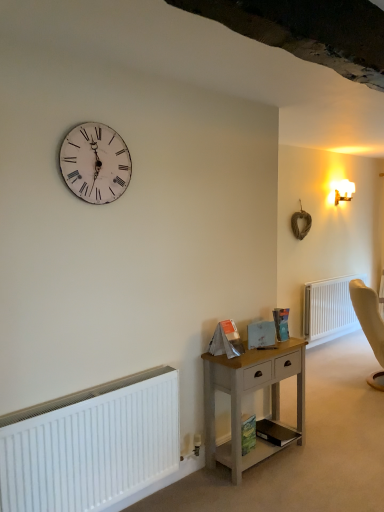
Describe the element at coordinates (248, 393) in the screenshot. This screenshot has width=384, height=512. I see `light wood nightstand at lower center` at that location.

Measure the distance between point (318, 339) and camera.

The distance of point (318, 339) from camera is 17.86 feet.

At what (x,y) coordinates should I click in order to perform the action: click on green matte book at lower center, which is the second book from top to bottom. Please return your answer as a coordinate pair (x, y). Image resolution: width=384 pixels, height=512 pixels. Looking at the image, I should click on (248, 433).

The image size is (384, 512). I want to click on white distressed wood clock at upper left, so click(95, 163).

The width and height of the screenshot is (384, 512). What do you see at coordinates (276, 432) in the screenshot? I see `black matte book at lower center, positioned as the first book in bottom-to-top order` at bounding box center [276, 432].

Measure the distance between point (76, 424) and camera.

Point (76, 424) and camera are 2.02 meters apart from each other.

Where is `light wood nightstand at lower center`? The image size is (384, 512). light wood nightstand at lower center is located at coordinates (248, 393).

Which is more to the right, light wood nightstand at lower center or white matte radiator at lower left, which ranks as the second radiator in right-to-left order?

From the viewer's perspective, light wood nightstand at lower center appears more on the right side.

Which object is closer to the camera, light wood nightstand at lower center or white matte radiator at lower left, positioned as the second radiator in back-to-front order?

white matte radiator at lower left, positioned as the second radiator in back-to-front order.

Who is smaller, light wood nightstand at lower center or white matte radiator at lower left, arranged as the first radiator when viewed from the front?

white matte radiator at lower left, arranged as the first radiator when viewed from the front, is smaller.

Considering the positions of point (234, 425) and point (51, 418), is point (234, 425) closer or farther from the camera than point (51, 418)?

Point (234, 425).

Considering the points (153, 378) and (273, 440), which point is behind, point (153, 378) or point (273, 440)?

Point (273, 440)

Based on the photo, from a real-world perspective, which object stands above the other?

white matte radiator at lower left, the first radiator from the left.

Is black matte book at lower center, marked as the 3th book in a top-to-bottom arrangement, located within white matte radiator at lower left, arranged as the first radiator when viewed from the front?

No, black matte book at lower center, marked as the 3th book in a top-to-bottom arrangement, is not a part of white matte radiator at lower left, arranged as the first radiator when viewed from the front.

Is white matte radiator at lower left, the first radiator from the left, looking in the opposite direction of black matte book at lower center, positioned as the first book in bottom-to-top order?

No, white matte radiator at lower left, the first radiator from the left, is not facing the opposite direction of black matte book at lower center, positioned as the first book in bottom-to-top order.

Which object is closer to the camera taking this photo, white matte radiator at lower left, which ranks as the second radiator in right-to-left order, or green matte book at lower center, marked as the second book in a bottom-to-top arrangement?

white matte radiator at lower left, which ranks as the second radiator in right-to-left order, is more forward.

Is white matte radiator at lower left, which ranks as the second radiator in right-to-left order, taller than green matte book at lower center, marked as the second book in a bottom-to-top arrangement?

Indeed, white matte radiator at lower left, which ranks as the second radiator in right-to-left order, has a greater height compared to green matte book at lower center, marked as the second book in a bottom-to-top arrangement.

From a real-world perspective, which is physically below, white matte radiator at lower left, positioned as the second radiator in back-to-front order, or green matte book at lower center, marked as the second book in a bottom-to-top arrangement?

green matte book at lower center, marked as the second book in a bottom-to-top arrangement.

Can you confirm if green matte book at lower center, which is the second book from top to bottom, is wider than white matte radiator at lower left, arranged as the first radiator when viewed from the front?

Incorrect, the width of green matte book at lower center, which is the second book from top to bottom, does not surpass that of white matte radiator at lower left, arranged as the first radiator when viewed from the front.

Based on the photo, in terms of size, does green matte book at lower center, which is the second book from top to bottom, appear bigger or smaller than white matte radiator at lower left, the first radiator from the left?

Considering their sizes, green matte book at lower center, which is the second book from top to bottom, takes up less space than white matte radiator at lower left, the first radiator from the left.

From a real-world perspective, is green matte book at lower center, which is the second book from top to bottom, positioned under white matte radiator at lower left, positioned as the second radiator in back-to-front order, based on gravity?

Yes.

Is light wood nightstand at lower center behind white distressed wood clock at upper left?

Yes, light wood nightstand at lower center is behind white distressed wood clock at upper left.

Is light wood nightstand at lower center bigger than white distressed wood clock at upper left?

Yes, light wood nightstand at lower center is bigger than white distressed wood clock at upper left.

From a real-world perspective, does light wood nightstand at lower center stand above white distressed wood clock at upper left?

No, from a real-world perspective, light wood nightstand at lower center is not over white distressed wood clock at upper left

Is white distressed wood clock at upper left at the back of light wood nightstand at lower center?

light wood nightstand at lower center is not turned away from white distressed wood clock at upper left.

From the image's perspective, is white plastic radiator at lower right, placed as the second radiator when sorted from front to back, below white distressed wood clock at upper left?

Yes, from the image's perspective, white plastic radiator at lower right, placed as the second radiator when sorted from front to back, is beneath white distressed wood clock at upper left.

You are a GUI agent. You are given a task and a screenshot of the screen. Output one action in this format:
    pyautogui.click(x=<x>, y=<y>)
    Task: Click on the wall clock above the white plastic radiator at lower right, placed as the second radiator when sorted from front to back (from the image's perspective)
    
    Given the screenshot: What is the action you would take?
    pyautogui.click(x=95, y=163)

Based on the photo, considering the sizes of white plastic radiator at lower right, arranged as the first radiator when viewed from the right, and white distressed wood clock at upper left in the image, is white plastic radiator at lower right, arranged as the first radiator when viewed from the right, bigger or smaller than white distressed wood clock at upper left?

white plastic radiator at lower right, arranged as the first radiator when viewed from the right, is bigger than white distressed wood clock at upper left.

Does white plastic radiator at lower right, which appears as the first radiator when viewed from the back, appear on the left side of white distressed wood clock at upper left?

No, white plastic radiator at lower right, which appears as the first radiator when viewed from the back, is not to the left of white distressed wood clock at upper left.

How different are the orientations of white frosted glass sconce at upper right and white matte radiator at lower left, positioned as the second radiator in back-to-front order, in degrees?

They differ by 0.336 degrees in their facing directions.

Locate an element on the screen. This screenshot has width=384, height=512. light fixture on the right of white matte radiator at lower left, the first radiator from the left is located at coordinates (343, 190).

From the image's perspective, is white frosted glass sconce at upper right under white matte radiator at lower left, arranged as the first radiator when viewed from the front?

No.

Considering the sizes of white frosted glass sconce at upper right and white matte radiator at lower left, arranged as the first radiator when viewed from the front, in the image, is white frosted glass sconce at upper right bigger or smaller than white matte radiator at lower left, arranged as the first radiator when viewed from the front,?

white frosted glass sconce at upper right is smaller than white matte radiator at lower left, arranged as the first radiator when viewed from the front.

I want to click on the 2nd radiator positioned above the light wood nightstand at lower center (from a real-world perspective), so click(91, 445).

From the image's perspective, count 2nd books downward from the white matte radiator at lower left, which ranks as the second radiator in right-to-left order, and point to it. Please provide its 2D coordinates.

[(276, 432)]

Estimate the real-world distances between objects in this image. Which object is further from white plastic radiator at lower right, arranged as the first radiator when viewed from the right, green matte book at lower center, marked as the second book in a bottom-to-top arrangement, or white frosted glass sconce at upper right?

The object further to white plastic radiator at lower right, arranged as the first radiator when viewed from the right, is green matte book at lower center, marked as the second book in a bottom-to-top arrangement.

Estimate the real-world distances between objects in this image. Which object is further from light wood nightstand at lower center, green matte book at lower center, marked as the second book in a bottom-to-top arrangement, or white distressed wood clock at upper left?

white distressed wood clock at upper left is further to light wood nightstand at lower center.

Based on their spatial positions, is hardcover book at center, the 3th book from the bottom, or green matte book at lower center, marked as the second book in a bottom-to-top arrangement, further from white plastic radiator at lower right, arranged as the first radiator when viewed from the right?

Among the two, green matte book at lower center, marked as the second book in a bottom-to-top arrangement, is located further to white plastic radiator at lower right, arranged as the first radiator when viewed from the right.

Which object lies nearer to the anchor point white matte radiator at lower left, arranged as the first radiator when viewed from the front, black matte book at lower center, positioned as the first book in bottom-to-top order, or white distressed wood clock at upper left?

white distressed wood clock at upper left is positioned closer to the anchor white matte radiator at lower left, arranged as the first radiator when viewed from the front.

Based on their spatial positions, is white distressed wood clock at upper left or white matte radiator at lower left, arranged as the first radiator when viewed from the front, closer to black matte book at lower center, marked as the 3th book in a top-to-bottom arrangement?

white matte radiator at lower left, arranged as the first radiator when viewed from the front.

From the image, which object appears to be nearer to green matte book at lower center, marked as the second book in a bottom-to-top arrangement, white plastic radiator at lower right, which appears as the first radiator when viewed from the back, or white frosted glass sconce at upper right?

white plastic radiator at lower right, which appears as the first radiator when viewed from the back.

From the picture: Based on their spatial positions, is white distressed wood clock at upper left or white matte radiator at lower left, which ranks as the second radiator in right-to-left order, closer to white frosted glass sconce at upper right?

The object closer to white frosted glass sconce at upper right is white distressed wood clock at upper left.

Which object lies nearer to the anchor point white matte radiator at lower left, positioned as the second radiator in back-to-front order, light wood nightstand at lower center or green matte book at lower center, marked as the second book in a bottom-to-top arrangement?

light wood nightstand at lower center is closer to white matte radiator at lower left, positioned as the second radiator in back-to-front order.

Find the location of a particular element. This screenshot has width=384, height=512. book between white distressed wood clock at upper left and green matte book at lower center, which is the second book from top to bottom, in the up-down direction is located at coordinates (281, 323).

This screenshot has height=512, width=384. In order to click on nightstand positioned between white matte radiator at lower left, positioned as the second radiator in back-to-front order, and hardcover book at center, the 3th book from the bottom, from near to far in this screenshot , I will do `click(248, 393)`.

Identify the location of book between light wood nightstand at lower center and black matte book at lower center, marked as the 3th book in a top-to-bottom arrangement, along the z-axis. (248, 433).

Find the location of a particular element. This screenshot has height=512, width=384. book between white distressed wood clock at upper left and light wood nightstand at lower center in the vertical direction is located at coordinates (x=281, y=323).